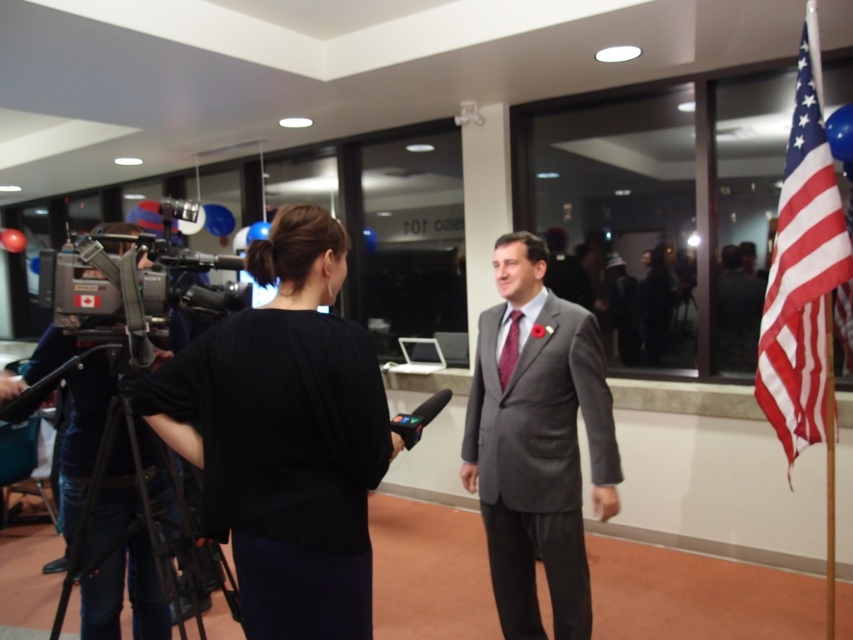
Between point (532, 627) and point (498, 360), which one is positioned behind?

The point (532, 627) is more distant.

Is the position of matte gray suit at center more distant than that of red textured tie at center?

No.

Where is `matte gray suit at center`? This screenshot has width=853, height=640. matte gray suit at center is located at coordinates (537, 444).

Who is shorter, black matte shirt at center or red textured tie at center?

Standing shorter between the two is red textured tie at center.

Can you confirm if black matte shirt at center is positioned to the right of red textured tie at center?

Incorrect, black matte shirt at center is not on the right side of red textured tie at center.

Which is in front, point (248, 512) or point (512, 333)?

Positioned in front is point (248, 512).

This screenshot has width=853, height=640. In order to click on black matte shirt at center in this screenshot , I will do `click(285, 436)`.

Does black matte shirt at center appear under red-white-striped flag at right?

Indeed, black matte shirt at center is positioned under red-white-striped flag at right.

Does black matte shirt at center have a greater width compared to red-white-striped flag at right?

Indeed, black matte shirt at center has a greater width compared to red-white-striped flag at right.

Which is behind, point (364, 506) or point (828, 428)?

The point (828, 428) is behind.

This screenshot has width=853, height=640. I want to click on black matte shirt at center, so click(285, 436).